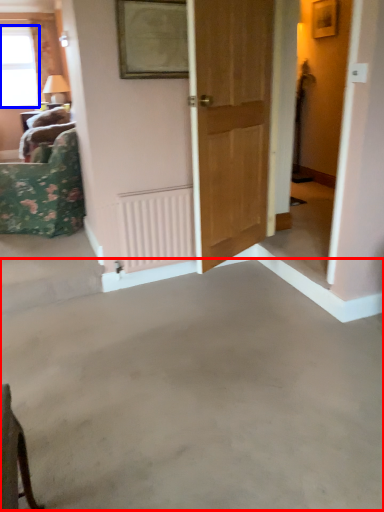
Question: Which point is closer to the camera, concrete (highlighted by a red box) or window (highlighted by a blue box)?

Choices:
 (A) concrete
 (B) window

Answer: (A)